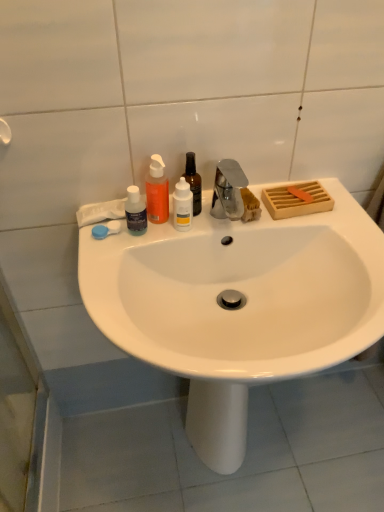
Question: From the image's perspective, relative to transparent plastic bottle at center, arranged as the 4th bottle when viewed from the left, is white matte bottle at center, which is counted as the second bottle, starting from the right, above or below?

Choices:
 (A) above
 (B) below

Answer: (B)

Question: Considering the positions of point (182, 210) and point (195, 170), is point (182, 210) closer or farther from the camera than point (195, 170)?

Choices:
 (A) closer
 (B) farther

Answer: (A)

Question: Which object is positioned closest to the white matte bottle at center, which is counted as the 3th bottle, starting from the left?

Choices:
 (A) translucent orange liquid at upper center, which is counted as the second bottle, starting from the left
 (B) white glossy sink at center
 (C) blue plastic soap at left
 (D) transparent plastic bottle at center, the first bottle in the right-to-left sequence
 (E) matte black bottle at left, which is the 1th bottle in left-to-right order

Answer: (D)

Question: Estimate the real-world distances between objects in this image. Which object is farther from the white matte bottle at center, which is counted as the second bottle, starting from the right?

Choices:
 (A) matte black bottle at left, the 4th bottle positioned from the right
 (B) white glossy sink at center
 (C) blue plastic soap at left
 (D) translucent orange liquid at upper center, which is the third bottle in right-to-left order
 (E) transparent plastic bottle at center, arranged as the 4th bottle when viewed from the left

Answer: (B)